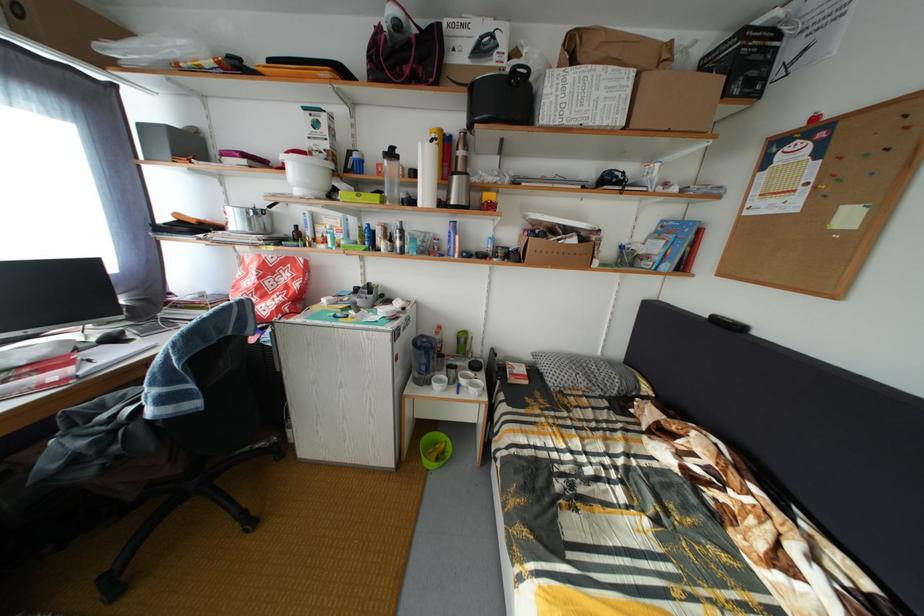
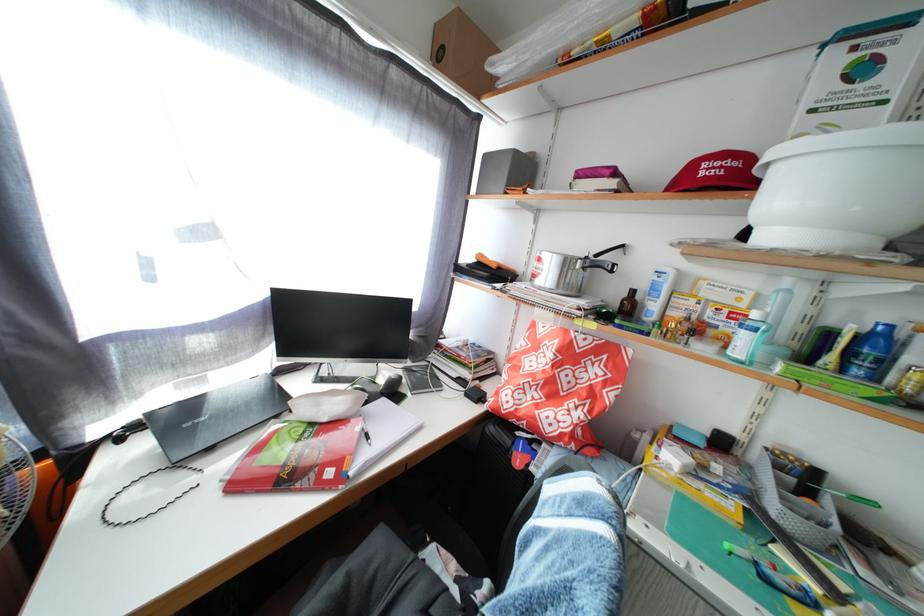
Locate, in the second image, the point that corresponds to point (375, 249) in the first image.

(866, 378)